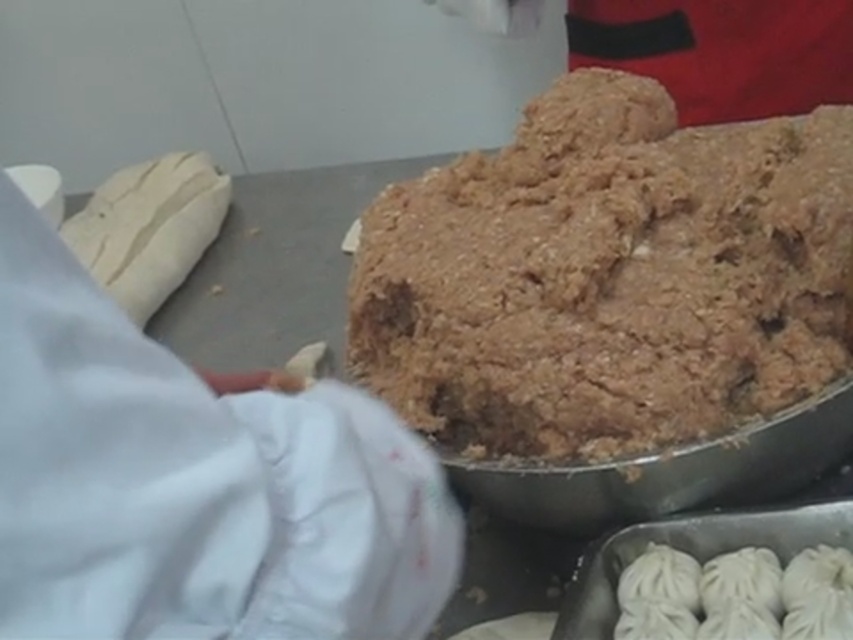
You are a food inspector standing in front of the food preparation area. You need to check the distance between the two points marked in the image. Which point is closer to you, point 1 at position (549, 280) or point 2 at position (387, 488)?

Point 2 at position (387, 488) is closer to you because it is less far from the camera compared to point 1 at position (549, 280).